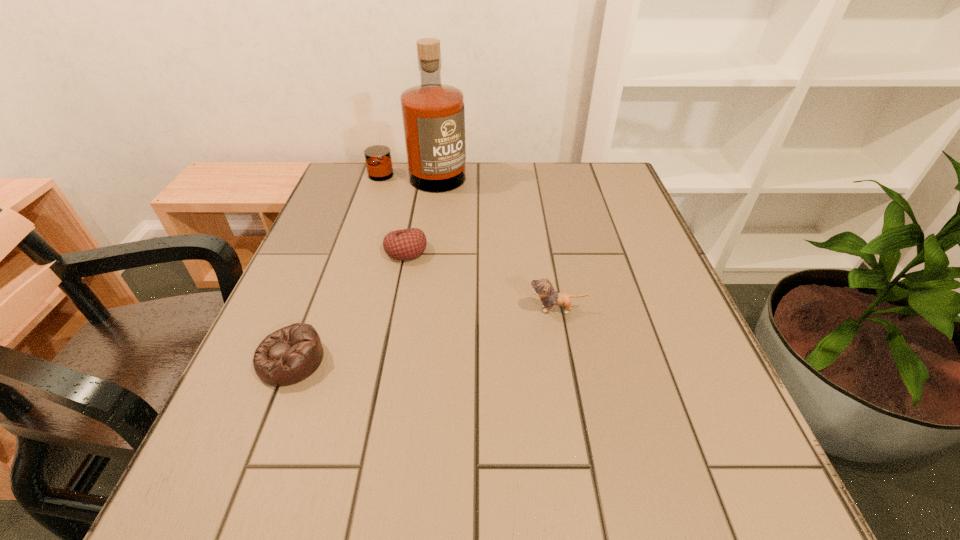
Locate an element on the screen. The width and height of the screenshot is (960, 540). vacant area situated 0.250m on the front-facing side of the rightmost object is located at coordinates (405, 309).

Identify the location of free location located 0.210m on the front-facing side of the rightmost object. The height and width of the screenshot is (540, 960). (425, 309).

Find the location of a particular element. Image resolution: width=960 pixels, height=540 pixels. vacant space situated on the left of the third nearest object is located at coordinates (364, 251).

Identify the location of free spot located on the back of the left beanbag. (309, 315).

This screenshot has height=540, width=960. I want to click on object that is at the far edge, so click(x=433, y=114).

In order to click on liquor located in the left edge section of the desktop in this screenshot , I will do `click(433, 114)`.

You are a GUI agent. You are given a task and a screenshot of the screen. Output one action in this format:
    pyautogui.click(x=<x>, y=<y>)
    Task: Click on the beanbag at the left edge
    The image size is (960, 540).
    Given the screenshot: What is the action you would take?
    pyautogui.click(x=289, y=355)

Find the location of a particular element. The width and height of the screenshot is (960, 540). object located at the far left corner is located at coordinates (433, 114).

Find the location of a particular element. vacant space at the far edge of the desktop is located at coordinates pyautogui.click(x=400, y=200).

This screenshot has width=960, height=540. I want to click on vacant space at the near edge of the desktop, so click(534, 512).